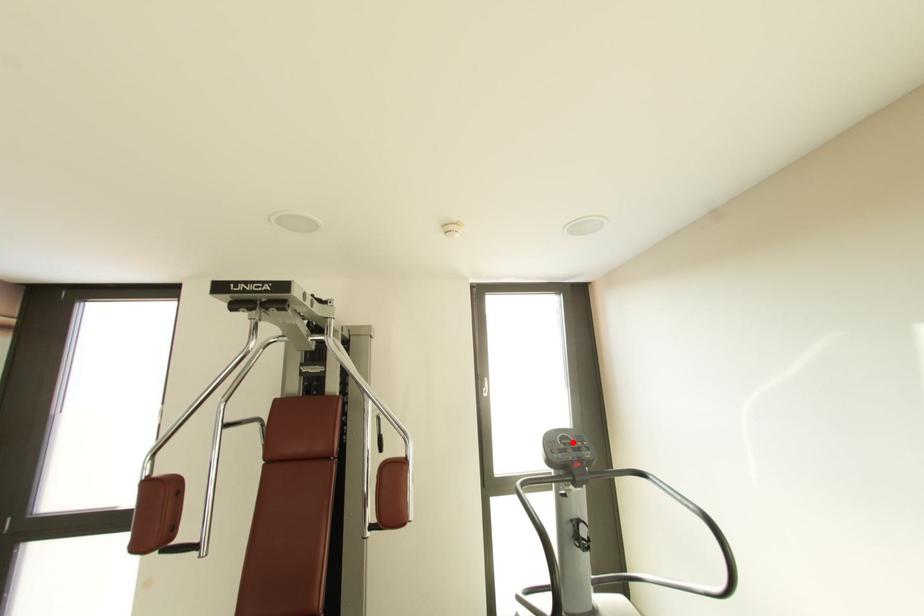
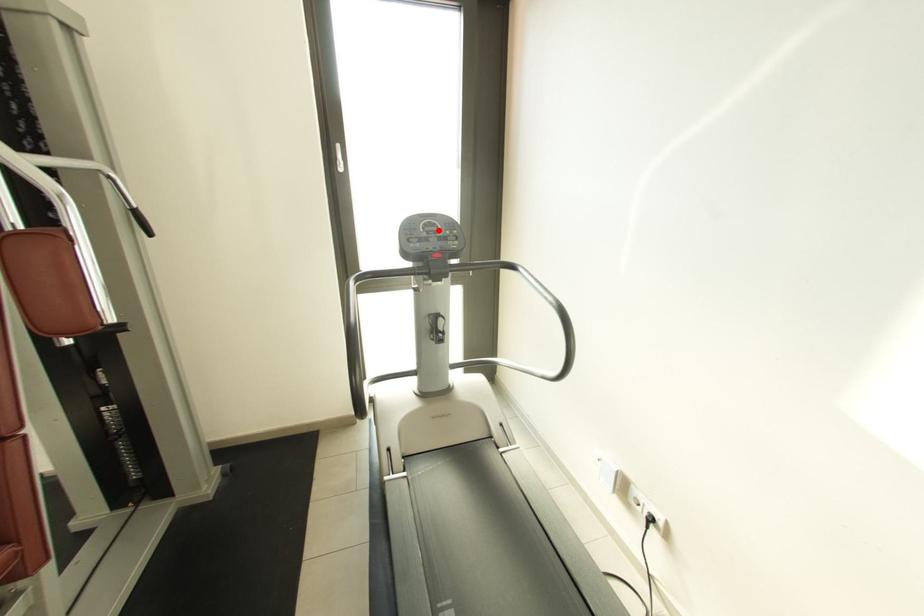
I am providing you with two images of the same scene from different viewpoints. A red point is marked on the first image and another point is marked on the second image. Is the red point in image1 aligned with the point shown in image2?

Yes